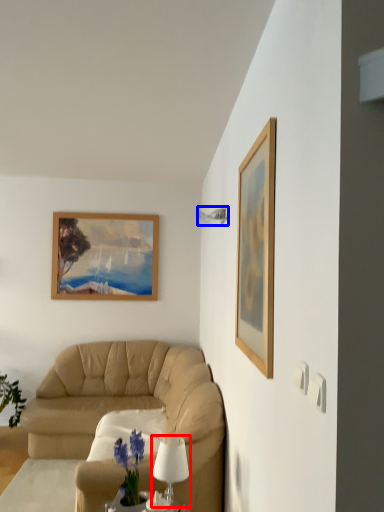
Question: Which object appears closest to the camera in this image, table lamp (highlighted by a red box) or lamp (highlighted by a blue box)?

Choices:
 (A) table lamp
 (B) lamp

Answer: (A)